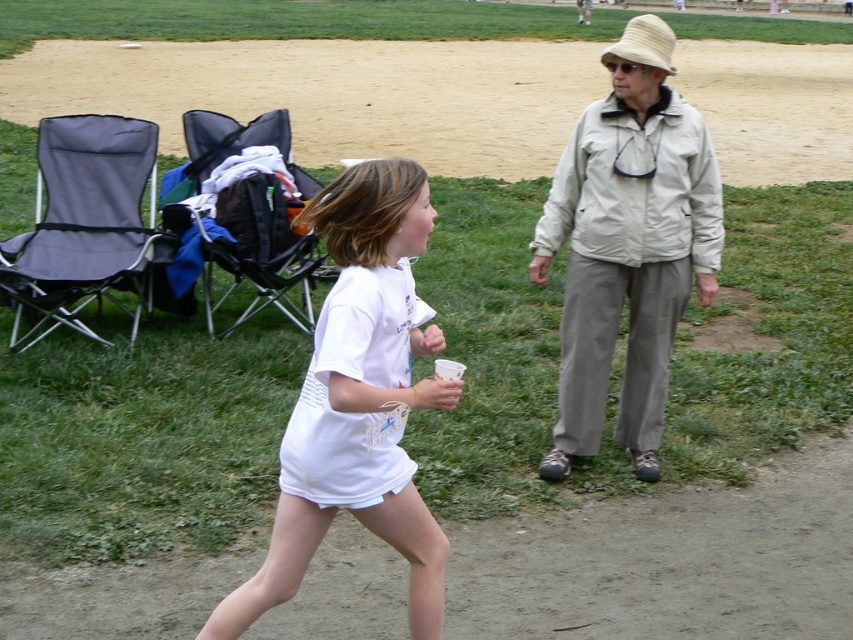
You are standing at the park and see two points marked in the image. Which point is closer to you, point (556, 624) or point (305, 490)?

Point (556, 624) is further to the viewer than point (305, 490), so point (305, 490) is closer to you.

The young girl is running on the brown dirt track at center. The older woman is standing on the grassy part of the park. How far apart are they?

They are 12.52 meters apart.

You are standing at the point with coordinates point (808,58) and want to walk towards the point with coordinates point (421,520). Which direction should you move to get closer to your destination?

Since point (808,58) is closer to the viewer than point (421,520), you should move forward to get closer to your destination.